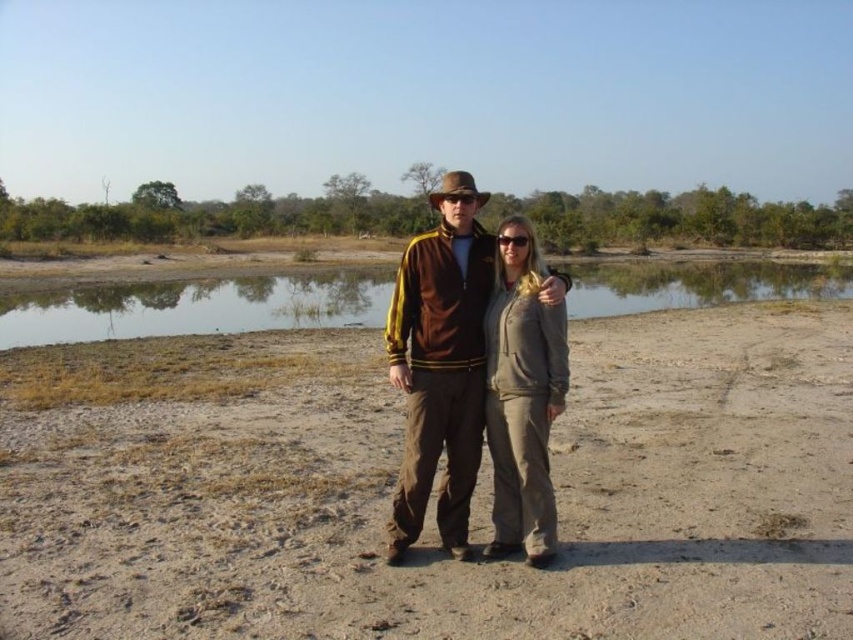
You are a photographer setting up a tripod to capture the scene with the brown sandy dirt at center and the brown suede jacket at center. Which object occupies more horizontal space in the image?

The brown sandy dirt at center has a greater width than the brown suede jacket at center, so it occupies more horizontal space in the image.

Looking at this image, you are a photographer trying to capture the reflection of the two people in the clear water at center. Based on their current positions, will their reflections be visible in the water?

The clear water at center is located at point (196, 307), so the photographer can capture the reflections of the two people as long as they are positioned within the water area.